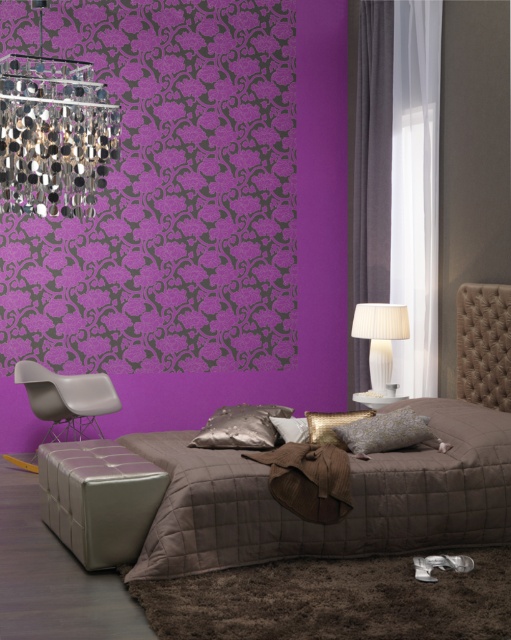
You are standing in the modern bedroom and want to take a photo of the metallic silver chandelier at upper left. If your camera can focus on objects up to 6 meters away, will you be able to capture a clear photo of the chandelier?

The metallic silver chandelier at upper left is 6.34 meters from camera, which is beyond the camera focus range of 6 meters. Therefore, you won

You are standing in the center of the bedroom and want to open the purple velvet curtain at right. Based on its coordinates, which direction should you move to reach it?

The purple velvet curtain at right is located at coordinates point [373,154], so you should move to the right side of the room to reach it.